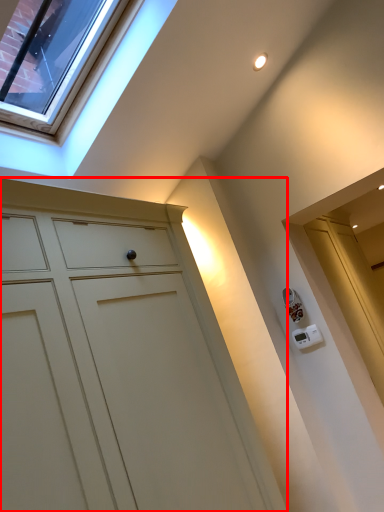
Question: From the image, what is the correct spatial relationship of cupboard (annotated by the red box) in relation to glass door?

Choices:
 (A) left
 (B) right

Answer: (B)